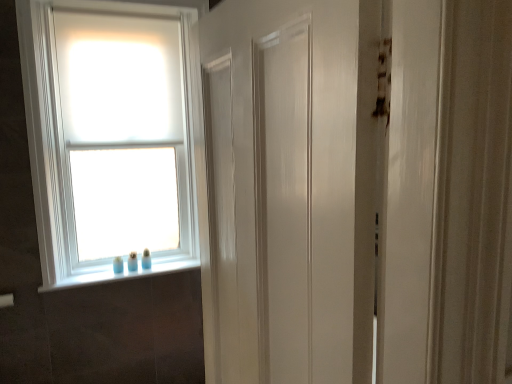
Question: Does white matte window at upper left have a larger size compared to white glossy window sill at lower left?

Choices:
 (A) no
 (B) yes

Answer: (B)

Question: Is white matte window at upper left touching white glossy window sill at lower left?

Choices:
 (A) no
 (B) yes

Answer: (A)

Question: Does white matte window at upper left have a smaller size compared to white glossy window sill at lower left?

Choices:
 (A) yes
 (B) no

Answer: (B)

Question: Is white matte window at upper left at the right side of white glossy window sill at lower left?

Choices:
 (A) no
 (B) yes

Answer: (A)

Question: Is white matte window at upper left outside of white glossy window sill at lower left?

Choices:
 (A) no
 (B) yes

Answer: (B)

Question: Does white matte window at upper left turn towards white glossy window sill at lower left?

Choices:
 (A) no
 (B) yes

Answer: (A)

Question: From the image's perspective, is white glossy window sill at lower left over white matte window at upper left?

Choices:
 (A) yes
 (B) no

Answer: (B)

Question: Would you say white matte window at upper left is part of white glossy window sill at lower left's contents?

Choices:
 (A) no
 (B) yes

Answer: (A)

Question: Considering the relative sizes of white glossy window sill at lower left and white matte window at upper left in the image provided, is white glossy window sill at lower left smaller than white matte window at upper left?

Choices:
 (A) yes
 (B) no

Answer: (A)

Question: Considering the relative sizes of white glossy window sill at lower left and white matte window at upper left in the image provided, is white glossy window sill at lower left taller than white matte window at upper left?

Choices:
 (A) yes
 (B) no

Answer: (B)

Question: Does white glossy window sill at lower left have a lesser width compared to white matte window at upper left?

Choices:
 (A) yes
 (B) no

Answer: (A)

Question: Does white glossy window sill at lower left appear on the right side of white matte window at upper left?

Choices:
 (A) no
 (B) yes

Answer: (B)

Question: Is white glossy window sill at lower left situated inside white matte window at upper left or outside?

Choices:
 (A) inside
 (B) outside

Answer: (B)